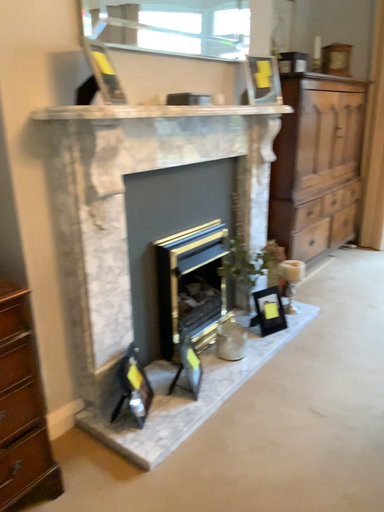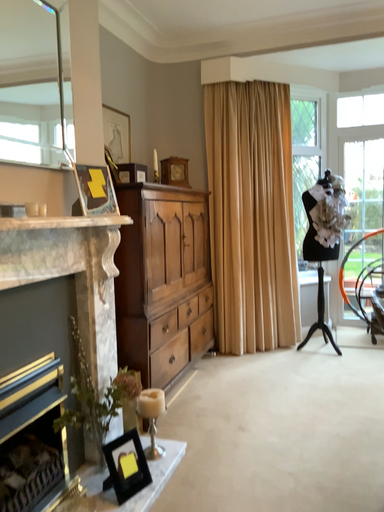
Question: How did the camera likely rotate when shooting the video?

Choices:
 (A) rotated left
 (B) rotated right

Answer: (B)